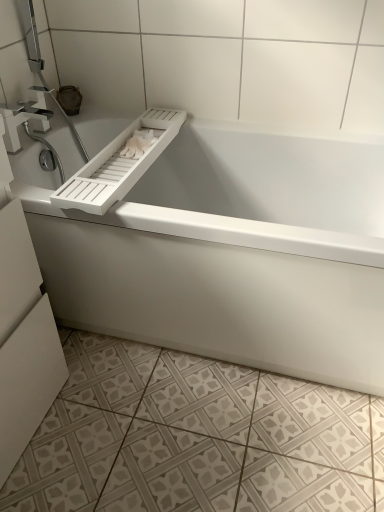
Locate an element on the screen. This screenshot has width=384, height=512. white matte bathtub at center is located at coordinates (229, 252).

Locate an element on the screen. This screenshot has width=384, height=512. white textured tile at lower center is located at coordinates (195, 438).

Measure the distance between point (x=140, y=133) and camera.

The depth of point (x=140, y=133) is 4.83 feet.

This screenshot has width=384, height=512. Describe the element at coordinates (24, 117) in the screenshot. I see `satin nickel faucet at upper left` at that location.

Locate an element on the screen. white matte bathtub at center is located at coordinates (229, 252).

What's the angular difference between white textured tile at lower center and white matte bathtub at center's facing directions?

The angular difference between white textured tile at lower center and white matte bathtub at center is 89.9 degrees.

From a real-world perspective, is white textured tile at lower center over white matte bathtub at center?

Actually, white textured tile at lower center is physically below white matte bathtub at center in the real world.

From their relative heights in the image, would you say white textured tile at lower center is taller or shorter than white matte bathtub at center?

In the image, white textured tile at lower center appears to be shorter than white matte bathtub at center.

In the image, is white textured tile at lower center positioned in front of or behind white matte bathtub at center?

white textured tile at lower center is in front of white matte bathtub at center.

In terms of width, does satin nickel faucet at upper left look wider or thinner when compared to white textured tile at lower center?

In the image, satin nickel faucet at upper left appears to be more narrow than white textured tile at lower center.

Where is `tap above the white textured tile at lower center (from a real-world perspective)`? The image size is (384, 512). tap above the white textured tile at lower center (from a real-world perspective) is located at coordinates (24, 117).

Is satin nickel faucet at upper left spatially inside white textured tile at lower center, or outside of it?

The correct answer is: outside.

Based on the photo, is satin nickel faucet at upper left in front of white textured tile at lower center?

No, it is behind white textured tile at lower center.

In the scene shown: Does white matte toilet paper at upper center come behind white textured tile at lower center?

Yes, it is behind white textured tile at lower center.

How different are the orientations of white matte toilet paper at upper center and white textured tile at lower center in degrees?

The angular difference between white matte toilet paper at upper center and white textured tile at lower center is 1.43 degrees.

From a real-world perspective, is white matte toilet paper at upper center physically located above or below white textured tile at lower center?

white matte toilet paper at upper center is above white textured tile at lower center.

In the scene shown: Considering the positions of objects white matte toilet paper at upper center and white textured tile at lower center in the image provided, who is more to the right, white matte toilet paper at upper center or white textured tile at lower center?

white textured tile at lower center.

From the picture: Considering the relative sizes of satin nickel faucet at upper left and white matte toilet paper at upper center in the image provided, is satin nickel faucet at upper left wider than white matte toilet paper at upper center?

In fact, satin nickel faucet at upper left might be narrower than white matte toilet paper at upper center.

Which is closer, (51, 116) or (124, 152)?

Point (51, 116) appears to be farther away from the viewer than point (124, 152).

How different are the orientations of satin nickel faucet at upper left and white matte toilet paper at upper center in degrees?

0.379 degrees separate the facing orientations of satin nickel faucet at upper left and white matte toilet paper at upper center.

The image size is (384, 512). I want to click on toilet paper to the right of satin nickel faucet at upper left, so click(x=138, y=144).

Between white matte toilet paper at upper center and satin nickel faucet at upper left, which one has larger width?

white matte toilet paper at upper center.

Does white matte toilet paper at upper center have a lesser height compared to satin nickel faucet at upper left?

Indeed, white matte toilet paper at upper center has a lesser height compared to satin nickel faucet at upper left.

Considering the relative sizes of white matte toilet paper at upper center and satin nickel faucet at upper left in the image provided, is white matte toilet paper at upper center bigger than satin nickel faucet at upper left?

Actually, white matte toilet paper at upper center might be smaller than satin nickel faucet at upper left.

How different are the orientations of white matte toilet paper at upper center and white matte bathtub at center in degrees?

The angular difference between white matte toilet paper at upper center and white matte bathtub at center is 88.5 degrees.

This screenshot has height=512, width=384. I want to click on bathtub on the right of white matte toilet paper at upper center, so click(229, 252).

Looking at this image, do you think white matte toilet paper at upper center is within white matte bathtub at center, or outside of it?

white matte toilet paper at upper center lies within the bounds of white matte bathtub at center.

Is white matte bathtub at center far from white textured tile at lower center?

Actually, white matte bathtub at center and white textured tile at lower center are a little close together.

From the image's perspective, which is above, white matte bathtub at center or white textured tile at lower center?

white matte bathtub at center, from the image's perspective.

Which is more to the right, white matte bathtub at center or white textured tile at lower center?

white matte bathtub at center is more to the right.

Identify the location of bathtub that is on the right side of white textured tile at lower center. (229, 252).

Locate an element on the screen. tap above the white textured tile at lower center (from the image's perspective) is located at coordinates (24, 117).

Considering their positions, is white matte bathtub at center positioned further to satin nickel faucet at upper left than white textured tile at lower center?

The object further to satin nickel faucet at upper left is white textured tile at lower center.

In the scene shown: When comparing their distances from white matte toilet paper at upper center, does white textured tile at lower center or white matte bathtub at center seem further?

Based on the image, white textured tile at lower center appears to be further to white matte toilet paper at upper center.

When comparing their distances from satin nickel faucet at upper left, does white matte toilet paper at upper center or white matte bathtub at center seem further?

white matte bathtub at center lies further to satin nickel faucet at upper left than the other object.

Estimate the real-world distances between objects in this image. Which object is closer to satin nickel faucet at upper left, white matte toilet paper at upper center or white textured tile at lower center?

The object closer to satin nickel faucet at upper left is white matte toilet paper at upper center.

Based on their spatial positions, is white textured tile at lower center or white matte toilet paper at upper center closer to satin nickel faucet at upper left?

Among the two, white matte toilet paper at upper center is located nearer to satin nickel faucet at upper left.

Which object lies further to the anchor point white matte toilet paper at upper center, satin nickel faucet at upper left or white textured tile at lower center?

white textured tile at lower center is positioned further to the anchor white matte toilet paper at upper center.

In the scene shown: Estimate the real-world distances between objects in this image. Which object is further from white matte bathtub at center, satin nickel faucet at upper left or white textured tile at lower center?

The object further to white matte bathtub at center is satin nickel faucet at upper left.

Considering their positions, is white matte bathtub at center positioned closer to white textured tile at lower center than white matte toilet paper at upper center?

The object closer to white textured tile at lower center is white matte bathtub at center.

Identify the location of bathtub between white matte toilet paper at upper center and white textured tile at lower center vertically. The height and width of the screenshot is (512, 384). (229, 252).

The image size is (384, 512). In order to click on bathtub that lies between satin nickel faucet at upper left and white textured tile at lower center from top to bottom in this screenshot , I will do `click(229, 252)`.

Identify the location of toilet paper between satin nickel faucet at upper left and white textured tile at lower center vertically. Image resolution: width=384 pixels, height=512 pixels. (138, 144).

This screenshot has width=384, height=512. Identify the location of toilet paper located between satin nickel faucet at upper left and white matte bathtub at center in the left-right direction. (138, 144).